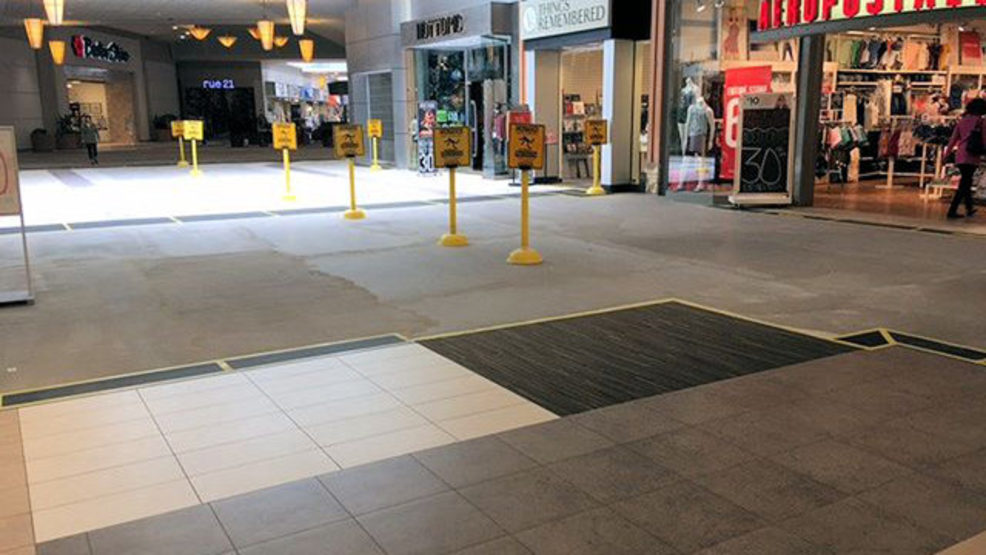
Find the location of a particular element. closed mall store gate is located at coordinates (x=377, y=108).